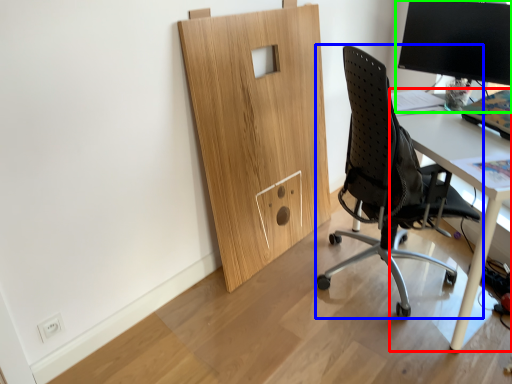
Question: Which object is positioned closest to desk (highlighted by a red box)? Select from chair (highlighted by a blue box) and desktop computer (highlighted by a green box).

Choices:
 (A) chair
 (B) desktop computer

Answer: (A)